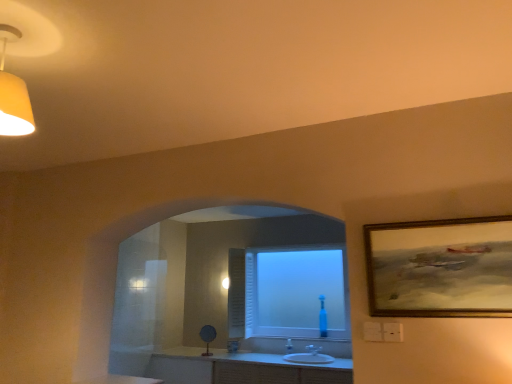
Question: Considering the relative positions of frosted glass window at center and white glossy sink at center in the image provided, is frosted glass window at center to the left or to the right of white glossy sink at center?

Choices:
 (A) left
 (B) right

Answer: (A)

Question: In terms of width, does frosted glass window at center look wider or thinner when compared to white glossy sink at center?

Choices:
 (A) thin
 (B) wide

Answer: (A)

Question: Estimate the real-world distances between objects in this image. Which object is closer to the white glossy counter top at lower center?

Choices:
 (A) frosted glass window at center
 (B) gold-framed painting at upper right
 (C) white glossy sink at center

Answer: (C)

Question: Based on their relative distances, which object is farther from the frosted glass window at center?

Choices:
 (A) white glossy sink at center
 (B) gold-framed painting at upper right
 (C) white glossy counter top at lower center

Answer: (B)